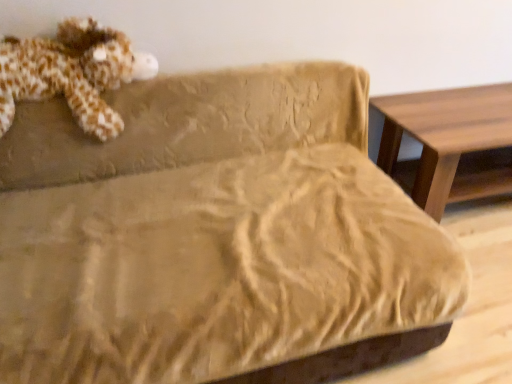
Question: From a real-world perspective, is fluffy brown plush at upper left on wooden table at right?

Choices:
 (A) no
 (B) yes

Answer: (B)

Question: Does fluffy brown plush at upper left turn towards wooden table at right?

Choices:
 (A) no
 (B) yes

Answer: (A)

Question: From the image's perspective, would you say fluffy brown plush at upper left is shown under wooden table at right?

Choices:
 (A) no
 (B) yes

Answer: (A)

Question: Is fluffy brown plush at upper left positioned behind wooden table at right?

Choices:
 (A) yes
 (B) no

Answer: (B)

Question: Is fluffy brown plush at upper left not within wooden table at right?

Choices:
 (A) yes
 (B) no

Answer: (A)

Question: Considering the relative sizes of fluffy brown plush at upper left and wooden table at right in the image provided, is fluffy brown plush at upper left thinner than wooden table at right?

Choices:
 (A) no
 (B) yes

Answer: (B)

Question: Is wooden table at right facing towards fluffy brown plush at upper left?

Choices:
 (A) no
 (B) yes

Answer: (A)

Question: Can you confirm if wooden table at right is positioned to the left of fluffy brown plush at upper left?

Choices:
 (A) no
 (B) yes

Answer: (A)

Question: Can you confirm if wooden table at right is smaller than fluffy brown plush at upper left?

Choices:
 (A) no
 (B) yes

Answer: (A)

Question: Is wooden table at right to the right of fluffy brown plush at upper left from the viewer's perspective?

Choices:
 (A) yes
 (B) no

Answer: (A)

Question: Is wooden table at right bigger than fluffy brown plush at upper left?

Choices:
 (A) yes
 (B) no

Answer: (A)

Question: Can you confirm if wooden table at right is thinner than fluffy brown plush at upper left?

Choices:
 (A) no
 (B) yes

Answer: (A)

Question: Looking at the image, does fluffy brown plush at upper left seem bigger or smaller compared to wooden table at right?

Choices:
 (A) big
 (B) small

Answer: (B)